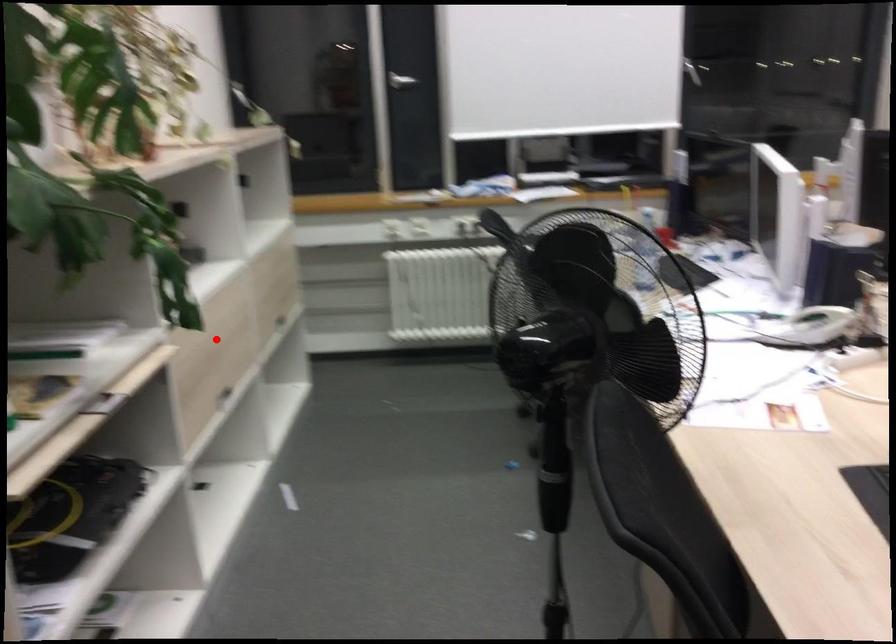
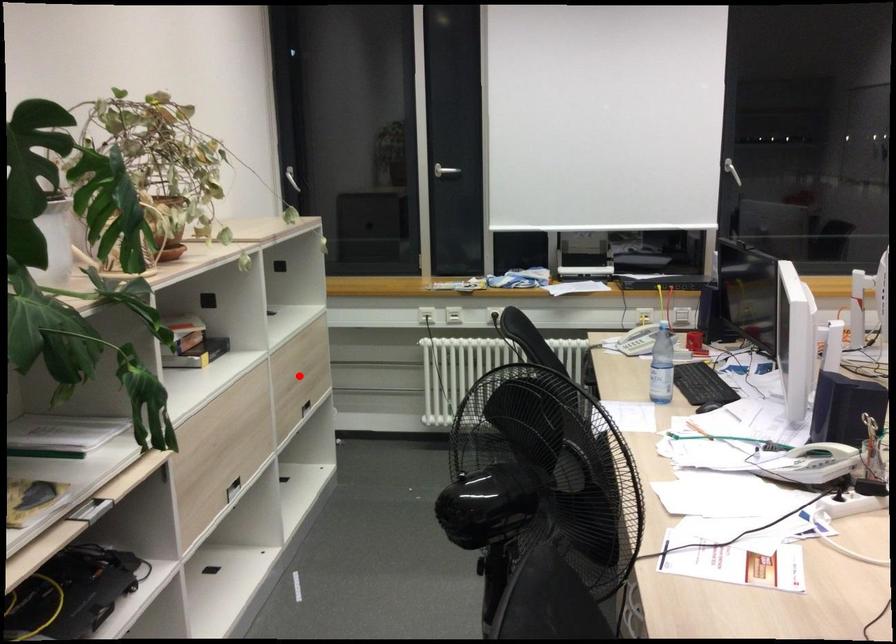
I am providing you with two images of the same scene from different viewpoints. A red point is marked on the first image and another point is marked on the second image. Do the highlighted points in image1 and image2 indicate the same real-world spot?

No